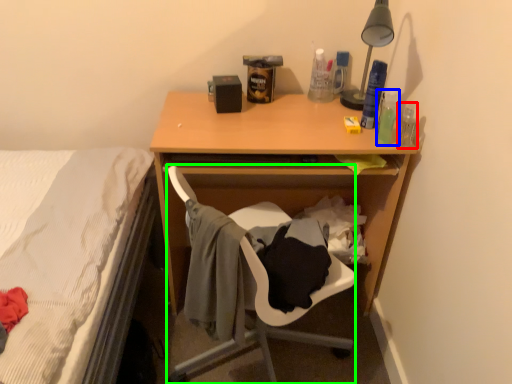
Question: Estimate the real-world distances between objects in this image. Which object is closer to bottle (highlighted by a red box), bottle (highlighted by a blue box) or chair (highlighted by a green box)?

Choices:
 (A) bottle
 (B) chair

Answer: (A)